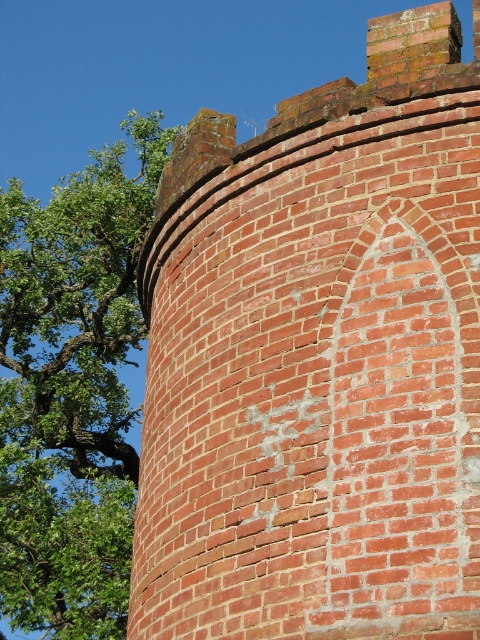
How distant is red brick wall at center from green leafy tree at upper left?

They are 109.07 feet apart.

Does red brick wall at center appear on the left side of green leafy tree at upper left?

Incorrect, red brick wall at center is not on the left side of green leafy tree at upper left.

Between point (224, 522) and point (133, 113), which one is positioned behind?

Point (133, 113)

Find the location of `red brick wall at center`. red brick wall at center is located at coordinates (317, 360).